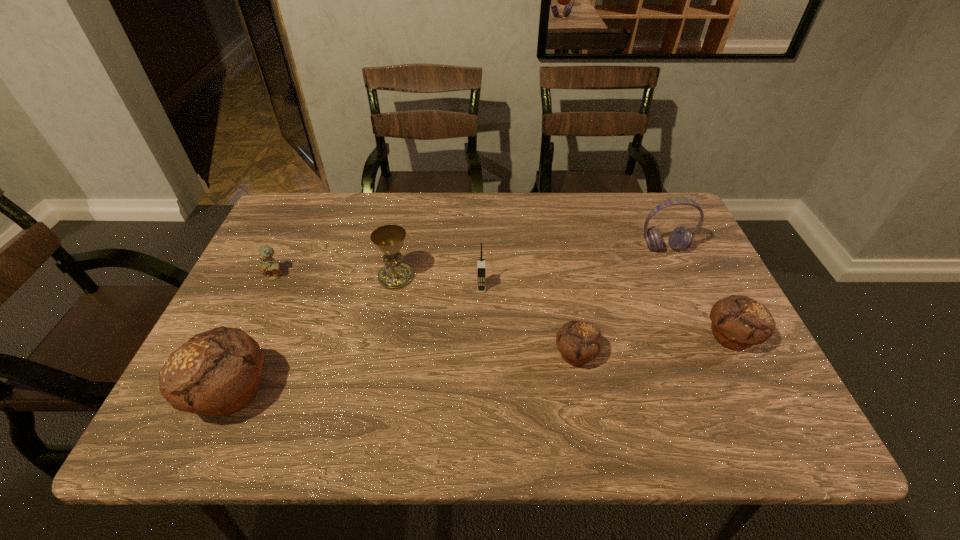
If the aim is uniform spacing by inserting an additional muffin among them, please point to a vacant space for this new muffin. Please provide its 2D coordinates. Your answer should be formatted as a tuple, i.e. [(x, y)], where the tuple contains the x and y coordinates of a point satisfying the conditions above.

[(410, 373)]